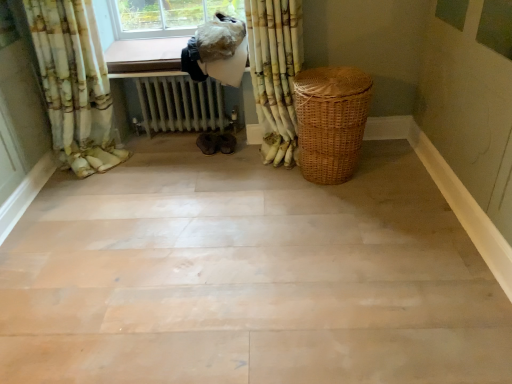
I want to click on wooden floor at center, so click(x=248, y=277).

Image resolution: width=512 pixels, height=384 pixels. What do you see at coordinates (331, 121) in the screenshot? I see `woven brown basket at right` at bounding box center [331, 121].

I want to click on woven brown basket at right, so click(331, 121).

What do you see at coordinates (275, 73) in the screenshot?
I see `white textured curtain at upper right, placed as the 1th curtain when sorted from right to left` at bounding box center [275, 73].

The width and height of the screenshot is (512, 384). Describe the element at coordinates (181, 105) in the screenshot. I see `white metallic radiator at center` at that location.

This screenshot has height=384, width=512. Describe the element at coordinates (75, 84) in the screenshot. I see `floral fabric curtain at upper left, placed as the second curtain when sorted from right to left` at that location.

Identify the location of wooden floor at center. (248, 277).

From the image's perspective, which one is positioned lower, white textured curtain at upper right, the second curtain in the left-to-right sequence, or white metallic radiator at center?

white metallic radiator at center, from the image's perspective.

Is white textured curtain at upper right, placed as the 1th curtain when sorted from right to left, spatially inside white metallic radiator at center, or outside of it?

The correct answer is: outside.

Is white textured curtain at upper right, the second curtain in the left-to-right sequence, in contact with white metallic radiator at center?

No, white textured curtain at upper right, the second curtain in the left-to-right sequence, is not next to white metallic radiator at center.

Can you confirm if white textured curtain at upper right, placed as the 1th curtain when sorted from right to left, is positioned to the left of white metallic radiator at center?

No.

From the image's perspective, is white metallic radiator at center above white textured curtain at upper right, the second curtain in the left-to-right sequence?

No.

Is white textured curtain at upper right, the second curtain in the left-to-right sequence, located within white metallic radiator at center?

No, white textured curtain at upper right, the second curtain in the left-to-right sequence, is not surrounded by white metallic radiator at center.

Between point (154, 104) and point (297, 30), which one is positioned behind?

The point (154, 104) is more distant.

Is white metallic radiator at center to the left or to the right of white textured curtain at upper right, the second curtain in the left-to-right sequence, in the image?

Clearly, white metallic radiator at center is on the left of white textured curtain at upper right, the second curtain in the left-to-right sequence, in the image.

Based on the photo, are white metallic radiator at center and woven brown basket at right far apart?

They are positioned close to each other.

How many degrees apart are the facing directions of white metallic radiator at center and woven brown basket at right?

90.3 degrees separate the facing orientations of white metallic radiator at center and woven brown basket at right.

Image resolution: width=512 pixels, height=384 pixels. What are the coordinates of `basket in front of the white metallic radiator at center` in the screenshot? It's located at (331, 121).

Is white metallic radiator at center located outside woven brown basket at right?

Indeed, white metallic radiator at center is completely outside woven brown basket at right.

Between point (340, 171) and point (296, 122), which one is positioned behind?

The point (296, 122) is more distant.

Based on the photo, does woven brown basket at right have a lesser width compared to white textured curtain at upper right, placed as the 1th curtain when sorted from right to left?

Incorrect, the width of woven brown basket at right is not less than that of white textured curtain at upper right, placed as the 1th curtain when sorted from right to left.

From a real-world perspective, who is located lower, woven brown basket at right or white textured curtain at upper right, the second curtain in the left-to-right sequence?

In real-world perspective, woven brown basket at right is lower.

Locate an element on the screen. the 2nd curtain above the woven brown basket at right (from the image's perspective) is located at coordinates (275, 73).

The image size is (512, 384). Identify the location of basket on the right of the wooden floor at center. (331, 121).

Looking at their sizes, would you say wooden floor at center is wider or thinner than woven brown basket at right?

wooden floor at center is wider than woven brown basket at right.

Could you tell me if wooden floor at center is turned towards woven brown basket at right?

No, wooden floor at center is not facing towards woven brown basket at right.

Visually, is wooden floor at center positioned to the left or to the right of woven brown basket at right?

wooden floor at center is positioned on woven brown basket at right's left side.

Is floral fabric curtain at upper left, the 1th curtain in the left-to-right sequence, at the back of white metallic radiator at center?

No, white metallic radiator at center's orientation is not away from floral fabric curtain at upper left, the 1th curtain in the left-to-right sequence.

Locate an element on the screen. The width and height of the screenshot is (512, 384). radiator that appears behind the floral fabric curtain at upper left, the 1th curtain in the left-to-right sequence is located at coordinates (181, 105).

Is white metallic radiator at center taller than floral fabric curtain at upper left, the 1th curtain in the left-to-right sequence?

No.

From a real-world perspective, between white textured curtain at upper right, placed as the 1th curtain when sorted from right to left, and wooden floor at center, who is vertically higher?

In real-world perspective, white textured curtain at upper right, placed as the 1th curtain when sorted from right to left, is above.

Can you confirm if white textured curtain at upper right, placed as the 1th curtain when sorted from right to left, is positioned to the left of wooden floor at center?

In fact, white textured curtain at upper right, placed as the 1th curtain when sorted from right to left, is to the right of wooden floor at center.

What's the angular difference between white textured curtain at upper right, placed as the 1th curtain when sorted from right to left, and wooden floor at center's facing directions?

There is a 93.4-degree angle between the facing directions of white textured curtain at upper right, placed as the 1th curtain when sorted from right to left, and wooden floor at center.

In terms of height, does white textured curtain at upper right, the second curtain in the left-to-right sequence, look taller or shorter compared to wooden floor at center?

white textured curtain at upper right, the second curtain in the left-to-right sequence, is taller than wooden floor at center.

This screenshot has height=384, width=512. I want to click on the 1st curtain in front of the white metallic radiator at center, so click(x=275, y=73).

At what (x,y) coordinates should I click in order to perform the action: click on curtain lying on the right of white metallic radiator at center. Please return your answer as a coordinate pair (x, y). Looking at the image, I should click on (275, 73).

Considering their positions, is floral fabric curtain at upper left, placed as the second curtain when sorted from right to left, positioned further to white metallic radiator at center than white textured curtain at upper right, placed as the 1th curtain when sorted from right to left?

white textured curtain at upper right, placed as the 1th curtain when sorted from right to left, is positioned further to the anchor white metallic radiator at center.

Considering their positions, is floral fabric curtain at upper left, the 1th curtain in the left-to-right sequence, positioned closer to woven brown basket at right than white metallic radiator at center?

The object closer to woven brown basket at right is white metallic radiator at center.

Considering their positions, is wooden floor at center positioned closer to floral fabric curtain at upper left, the 1th curtain in the left-to-right sequence, than white metallic radiator at center?

white metallic radiator at center.

Based on their spatial positions, is wooden floor at center or woven brown basket at right closer to floral fabric curtain at upper left, placed as the second curtain when sorted from right to left?

The object closer to floral fabric curtain at upper left, placed as the second curtain when sorted from right to left, is wooden floor at center.

From the image, which object appears to be farther from woven brown basket at right, wooden floor at center or floral fabric curtain at upper left, placed as the second curtain when sorted from right to left?

floral fabric curtain at upper left, placed as the second curtain when sorted from right to left, is positioned further to the anchor woven brown basket at right.

From the image, which object appears to be farther from white textured curtain at upper right, placed as the 1th curtain when sorted from right to left, white metallic radiator at center or wooden floor at center?

wooden floor at center is further to white textured curtain at upper right, placed as the 1th curtain when sorted from right to left.

Considering their positions, is woven brown basket at right positioned further to white metallic radiator at center than white textured curtain at upper right, placed as the 1th curtain when sorted from right to left?

The object further to white metallic radiator at center is woven brown basket at right.

Which object lies further to the anchor point white textured curtain at upper right, placed as the 1th curtain when sorted from right to left, white metallic radiator at center or woven brown basket at right?

The object further to white textured curtain at upper right, placed as the 1th curtain when sorted from right to left, is white metallic radiator at center.

At what (x,y) coordinates should I click in order to perform the action: click on stairwell located between floral fabric curtain at upper left, the 1th curtain in the left-to-right sequence, and woven brown basket at right in the left-right direction. Please return your answer as a coordinate pair (x, y). This screenshot has height=384, width=512. Looking at the image, I should click on (248, 277).

Locate an element on the screen. The height and width of the screenshot is (384, 512). basket between wooden floor at center and white textured curtain at upper right, placed as the 1th curtain when sorted from right to left, along the z-axis is located at coordinates (331, 121).

The width and height of the screenshot is (512, 384). I want to click on curtain between floral fabric curtain at upper left, placed as the second curtain when sorted from right to left, and woven brown basket at right from left to right, so click(x=275, y=73).

I want to click on basket between wooden floor at center and white metallic radiator at center from front to back, so click(x=331, y=121).